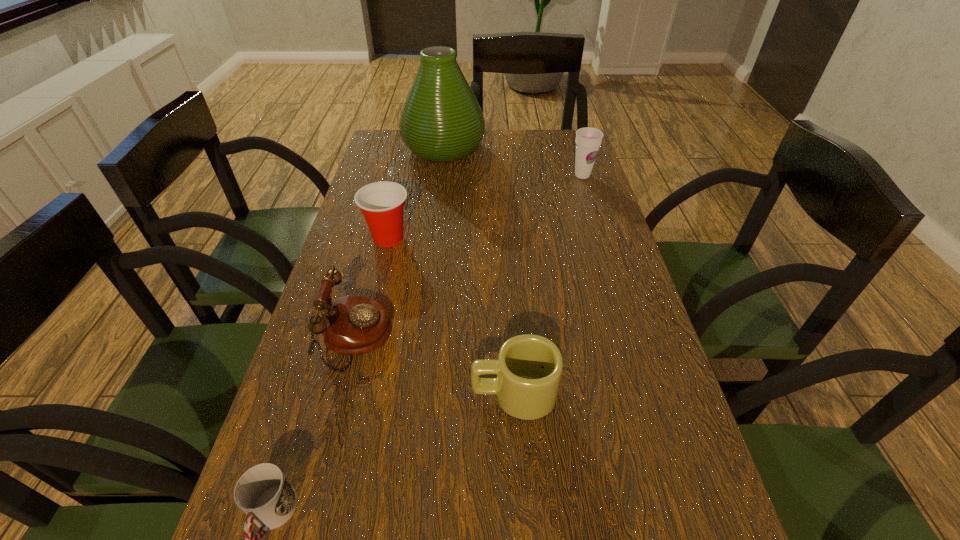
The height and width of the screenshot is (540, 960). I want to click on unoccupied area between the mug and the vase, so click(x=479, y=271).

The width and height of the screenshot is (960, 540). Find the location of `unoccupied area between the farthest cup and the telephone`. unoccupied area between the farthest cup and the telephone is located at coordinates (469, 256).

This screenshot has width=960, height=540. I want to click on object that is the third closest one to the nearest object, so click(382, 203).

Select which object is the second closest to the nearest object. Please provide its 2D coordinates. Your answer should be formatted as a tuple, i.e. [(x, y)], where the tuple contains the x and y coordinates of a point satisfying the conditions above.

[(529, 367)]

Locate an element on the screen. This screenshot has height=540, width=960. cup that can be found as the closest to the third farthest object is located at coordinates 588,140.

I want to click on cup that stands as the closest to the rightmost cup, so click(382, 203).

Find the location of a particular element. free space in the image that satisfies the following two spatial constraints: 1. on the front side of the tallest object; 2. on the dial of the telephone is located at coordinates (420, 338).

At what (x,y) coordinates should I click in order to perform the action: click on blank area in the image that satisfies the following two spatial constraints: 1. on the front side of the second farthest cup; 2. on the dial of the telephone. Please return your answer as a coordinate pair (x, y). The height and width of the screenshot is (540, 960). Looking at the image, I should click on (365, 338).